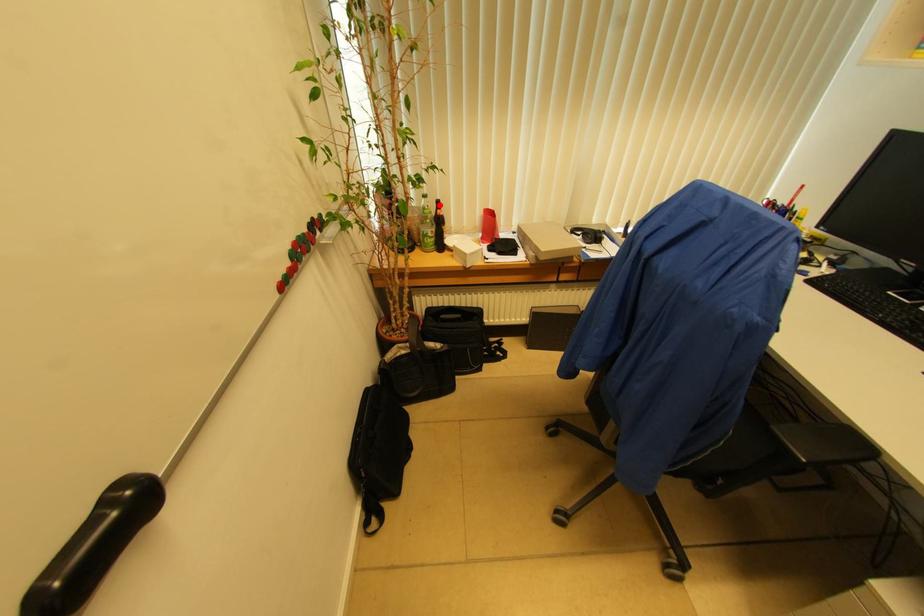
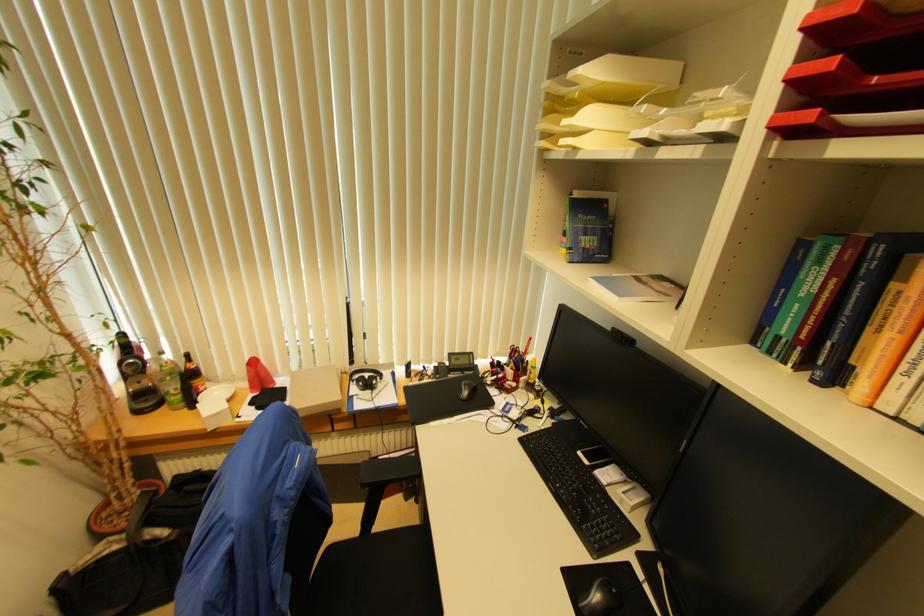
Locate, in the second image, the point that corresponds to the highlighted location in the first image.

(188, 358)